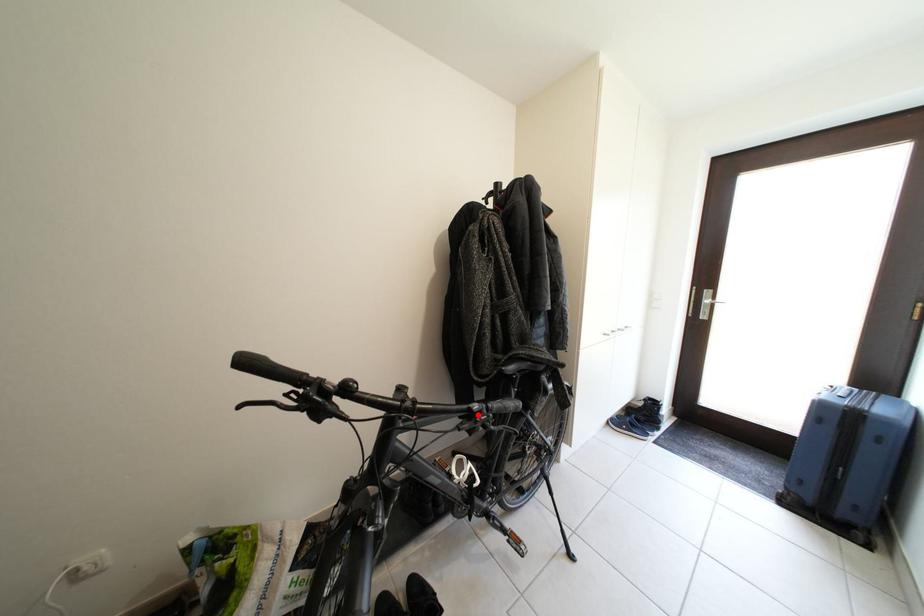
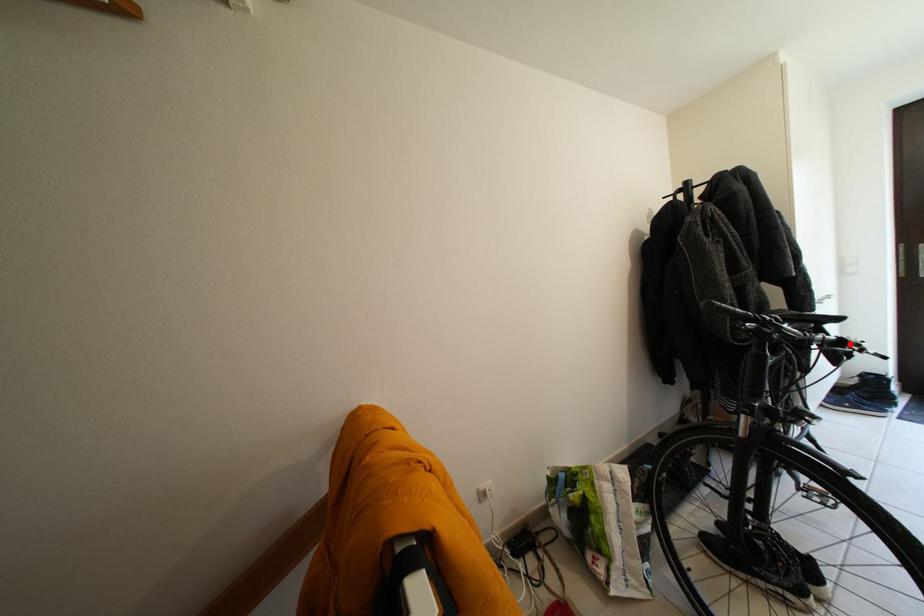
I am providing you with two images of the same scene from different viewpoints. A red point is marked on the first image and another point is marked on the second image. Is the marked point in image1 the same physical position as the marked point in image2?

Yes